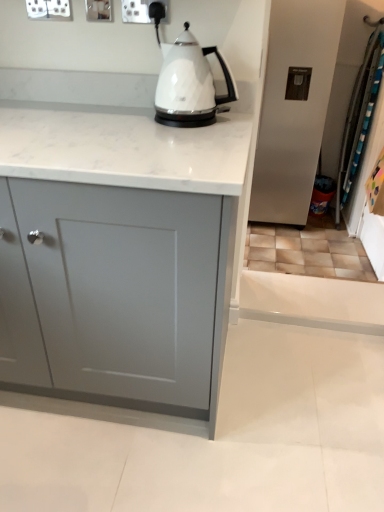
Question: Is white plastic socket at upper center taller than white glossy kettle at center?

Choices:
 (A) no
 (B) yes

Answer: (A)

Question: Would you say white plastic socket at upper center is a long distance from white glossy kettle at center?

Choices:
 (A) no
 (B) yes

Answer: (A)

Question: Is white glossy kettle at center located within white plastic socket at upper center?

Choices:
 (A) yes
 (B) no

Answer: (B)

Question: Considering the relative positions of white plastic socket at upper center and white glossy kettle at center in the image provided, is white plastic socket at upper center to the left of white glossy kettle at center from the viewer's perspective?

Choices:
 (A) no
 (B) yes

Answer: (B)

Question: Considering the relative sizes of white plastic socket at upper center and white glossy kettle at center in the image provided, is white plastic socket at upper center thinner than white glossy kettle at center?

Choices:
 (A) no
 (B) yes

Answer: (B)

Question: Considering the positions of point (130, 1) and point (129, 184), is point (130, 1) closer or farther from the camera than point (129, 184)?

Choices:
 (A) farther
 (B) closer

Answer: (A)

Question: Is white plastic socket at upper center situated inside matte gray cabinet at center or outside?

Choices:
 (A) inside
 (B) outside

Answer: (B)

Question: In terms of width, does white plastic socket at upper center look wider or thinner when compared to matte gray cabinet at center?

Choices:
 (A) thin
 (B) wide

Answer: (A)

Question: Looking at the image, does white plastic socket at upper center seem bigger or smaller compared to matte gray cabinet at center?

Choices:
 (A) big
 (B) small

Answer: (B)

Question: Visually, is matte gray cabinet at center positioned to the left or to the right of white glossy kettle at center?

Choices:
 (A) left
 (B) right

Answer: (A)

Question: From the image's perspective, is matte gray cabinet at center above or below white glossy kettle at center?

Choices:
 (A) below
 (B) above

Answer: (A)

Question: Relative to white glossy kettle at center, is matte gray cabinet at center in front or behind?

Choices:
 (A) front
 (B) behind

Answer: (A)

Question: Considering the positions of matte gray cabinet at center and white glossy kettle at center in the image, is matte gray cabinet at center wider or thinner than white glossy kettle at center?

Choices:
 (A) thin
 (B) wide

Answer: (B)

Question: Considering the positions of white glossy kettle at center and matte gray cabinet at center in the image, is white glossy kettle at center wider or thinner than matte gray cabinet at center?

Choices:
 (A) wide
 (B) thin

Answer: (B)

Question: From a real-world perspective, is white glossy kettle at center above or below matte gray cabinet at center?

Choices:
 (A) below
 (B) above

Answer: (B)